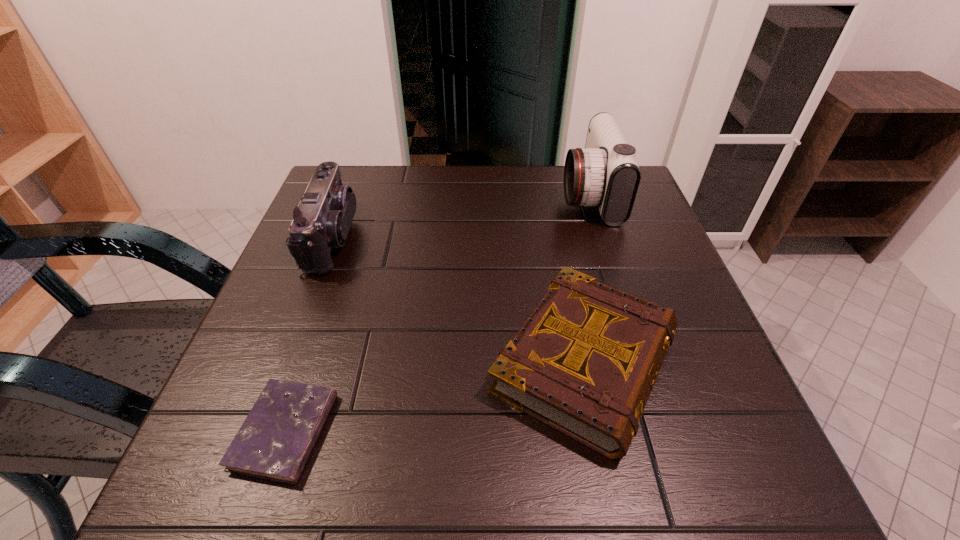
What are the coordinates of `vacant space situated 0.120m on the left of the hardback book` in the screenshot? It's located at (419, 362).

Locate an element on the screen. free spot located 0.280m on the back of the shortest object is located at coordinates coord(339,272).

Locate an element on the screen. hardback book that is at the near edge is located at coordinates (585, 361).

Where is `diary situated at the near edge`? Image resolution: width=960 pixels, height=540 pixels. diary situated at the near edge is located at coordinates (274, 442).

Where is `camcorder positioned at the left edge`? This screenshot has height=540, width=960. camcorder positioned at the left edge is located at coordinates (322, 220).

Locate an element on the screen. diary located in the left edge section of the desktop is located at coordinates (274, 442).

Where is `camcorder that is positioned at the right edge`? camcorder that is positioned at the right edge is located at coordinates (605, 174).

You are a GUI agent. You are given a task and a screenshot of the screen. Output one action in this format:
    pyautogui.click(x=<x>, y=<y>)
    Task: Click on the hardback book that is at the right edge
    
    Given the screenshot: What is the action you would take?
    pyautogui.click(x=585, y=361)

Identify the location of object at the far left corner. Image resolution: width=960 pixels, height=540 pixels. (322, 220).

You are a GUI agent. You are given a task and a screenshot of the screen. Output one action in this format:
    pyautogui.click(x=<x>, y=<y>)
    Task: Click on the object located at the near left corner
    The image size is (960, 540).
    Given the screenshot: What is the action you would take?
    pyautogui.click(x=274, y=442)